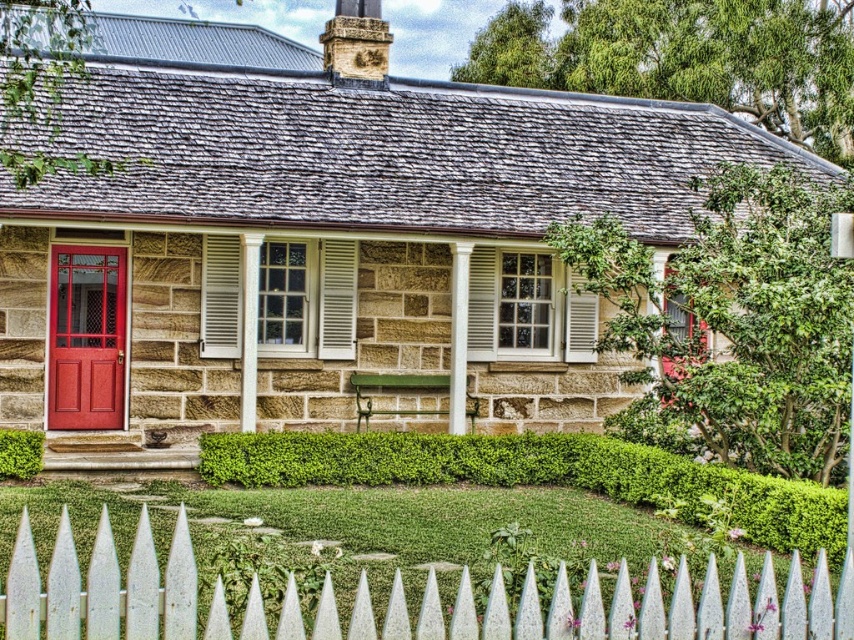
Question: Which point appears closest to the camera in this image?

Choices:
 (A) (477, 113)
 (B) (74, 404)

Answer: (B)

Question: Does stone cottage at center lie behind white matte shutter at center?

Choices:
 (A) yes
 (B) no

Answer: (B)

Question: Among these points, which one is nearest to the camera?

Choices:
 (A) (75, 317)
 (B) (588, 349)
 (C) (404, 337)
 (D) (235, 256)

Answer: (A)

Question: Estimate the real-world distances between objects in this image. Which object is farther from the green leafy hedge at right?

Choices:
 (A) green leafy hedge at lower left
 (B) green leafy hedge at center
 (C) white wooden picket fence at lower center
 (D) white matte shutter at center

Answer: (C)

Question: Does stone cottage at center appear over green leafy hedge at center?

Choices:
 (A) no
 (B) yes

Answer: (B)

Question: Can you confirm if stone cottage at center is smaller than white wooden shutter at center?

Choices:
 (A) yes
 (B) no

Answer: (B)